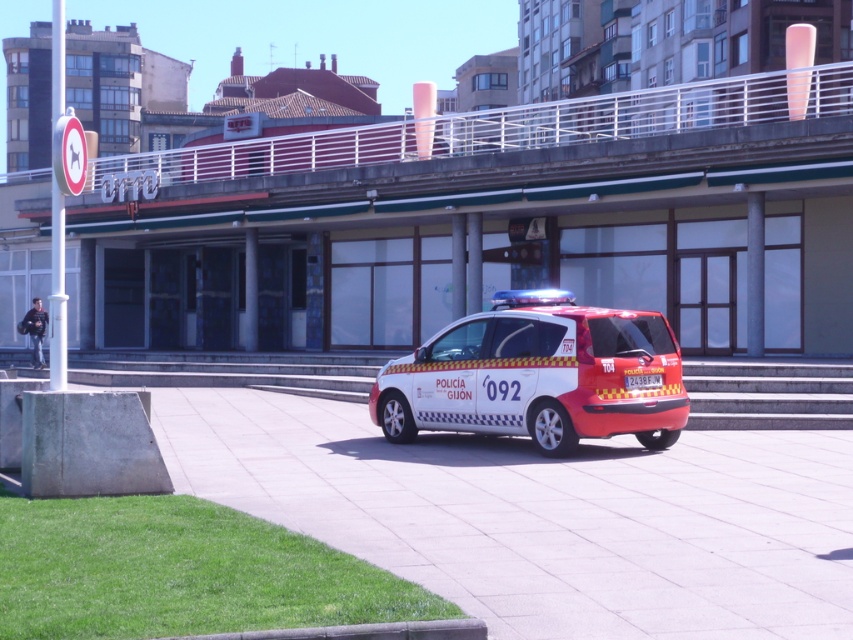
Who is positioned more to the left, white tile pavement at center or white plastic license plate at center?

From the viewer's perspective, white tile pavement at center appears more on the left side.

Locate an element on the screen. white tile pavement at center is located at coordinates (544, 515).

Between point (422, 524) and point (640, 374), which one is positioned in front?

Point (422, 524)

Identify the location of white tile pavement at center. (544, 515).

Does white glossy police car at center appear on the left side of white plastic license plate at center?

Correct, you'll find white glossy police car at center to the left of white plastic license plate at center.

Can you confirm if white glossy police car at center is shorter than white plastic license plate at center?

Incorrect, white glossy police car at center's height does not fall short of white plastic license plate at center's.

Which is in front, point (384, 371) or point (651, 380)?

Positioned in front is point (651, 380).

At what (x,y) coordinates should I click in order to perform the action: click on white glossy police car at center. Please return your answer as a coordinate pair (x, y). Looking at the image, I should click on (537, 376).

Does point (672, 552) come in front of point (483, 429)?

Yes, it is.

Between point (550, 582) and point (683, 412), which one is positioned in front?

Point (550, 582) is more forward.

At what (x,y) coordinates should I click in order to perform the action: click on white tile pavement at center. Please return your answer as a coordinate pair (x, y). The image size is (853, 640). Looking at the image, I should click on (544, 515).